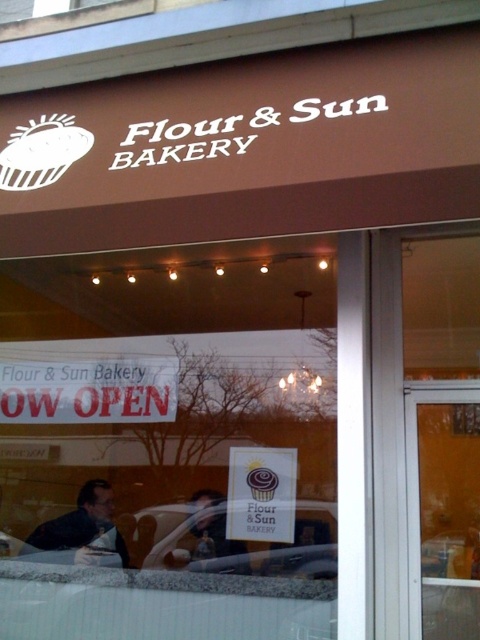
Does clear glass car at center have a larger size compared to matte black shirt at center?

No, clear glass car at center is not bigger than matte black shirt at center.

Is point (181, 506) more distant than point (238, 563)?

Yes, it is.

Which is in front, point (271, 552) or point (212, 524)?

Point (271, 552)

Image resolution: width=480 pixels, height=640 pixels. Identify the location of clear glass car at center. [236, 548].

Which is below, dark brown hair at lower left or matte black shirt at center?

dark brown hair at lower left is lower down.

Between dark brown hair at lower left and matte black shirt at center, which one appears on the left side from the viewer's perspective?

dark brown hair at lower left

Identify the location of dark brown hair at lower left. (84, 525).

This screenshot has width=480, height=640. In order to click on dark brown hair at lower left in this screenshot , I will do `click(84, 525)`.

This screenshot has width=480, height=640. Describe the element at coordinates (236, 548) in the screenshot. I see `clear glass car at center` at that location.

Is point (210, 525) positioned after point (67, 528)?

No.

Does point (183, 566) come closer to viewer compared to point (36, 529)?

No, (183, 566) is behind (36, 529).

You are a GUI agent. You are given a task and a screenshot of the screen. Output one action in this format:
    pyautogui.click(x=<x>, y=<y>)
    Task: Click on the clear glass car at center
    
    Given the screenshot: What is the action you would take?
    pyautogui.click(x=236, y=548)